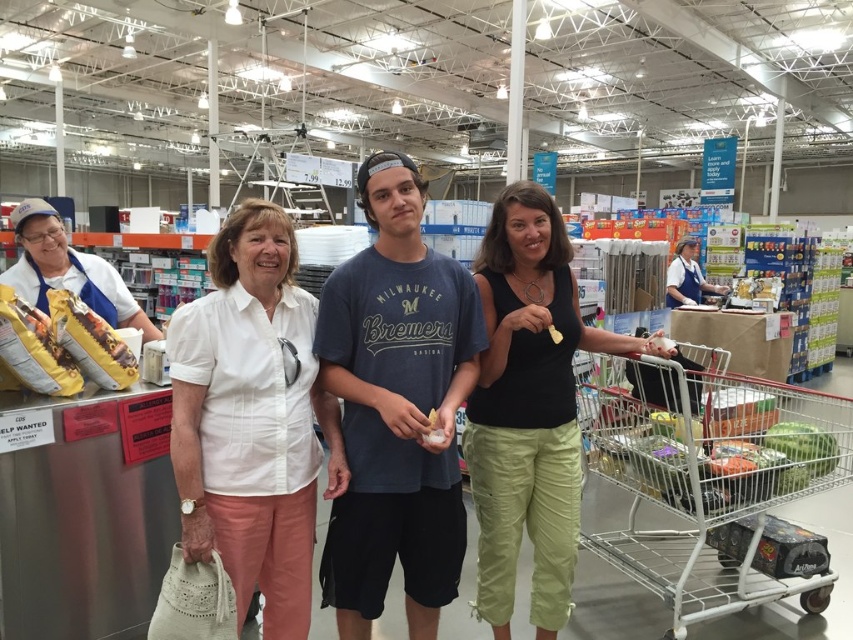
You are a photographer taking a picture of the white cotton blouse at center and the matte yellow cheese at center. Which object is taller in the photo?

The white cotton blouse at center is taller than the matte yellow cheese at center.

You are a photographer trying to capture a closeup of the white cotton blouse at center and the matte yellow cheese at center. Which object should you zoom in on to ensure both fit in the frame without cropping?

The white cotton blouse at center is wider than the matte yellow cheese at center, so you should zoom in on the matte yellow cheese at center to ensure both fit without cropping.